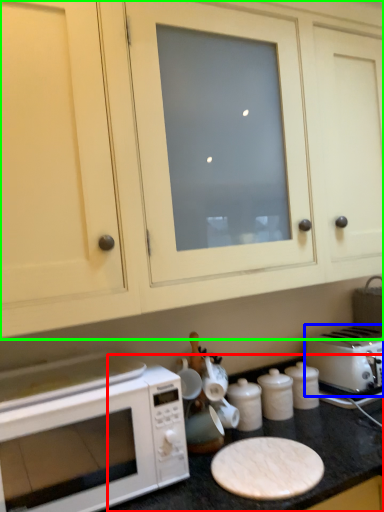
Question: Considering the real-world distances, which object is closest to counter top (highlighted by a red box)? toaster (highlighted by a blue box) or cabinetry (highlighted by a green box).

Choices:
 (A) toaster
 (B) cabinetry

Answer: (A)